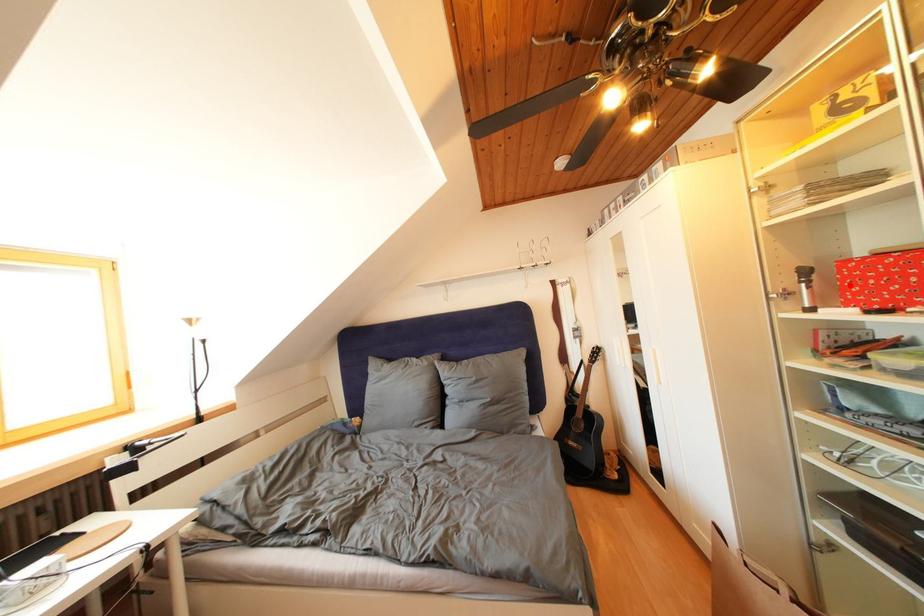
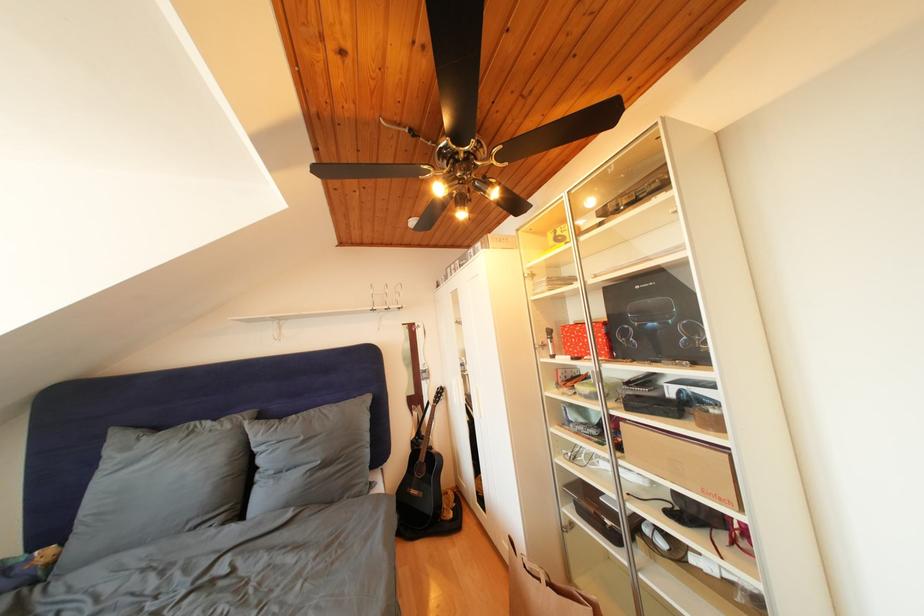
The point at the highlighted location is marked in the first image. Where is the corresponding point in the second image?

(572, 342)